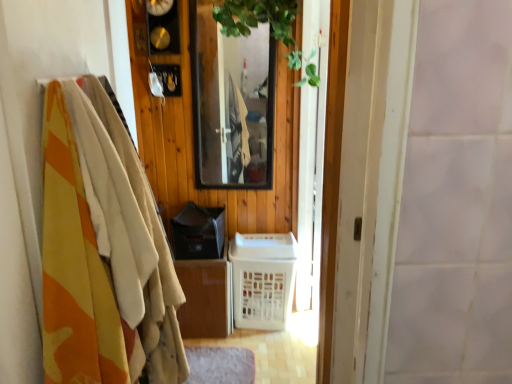
Locate an element on the screen. This screenshot has height=384, width=512. free space in front of white plastic basket at center is located at coordinates (275, 351).